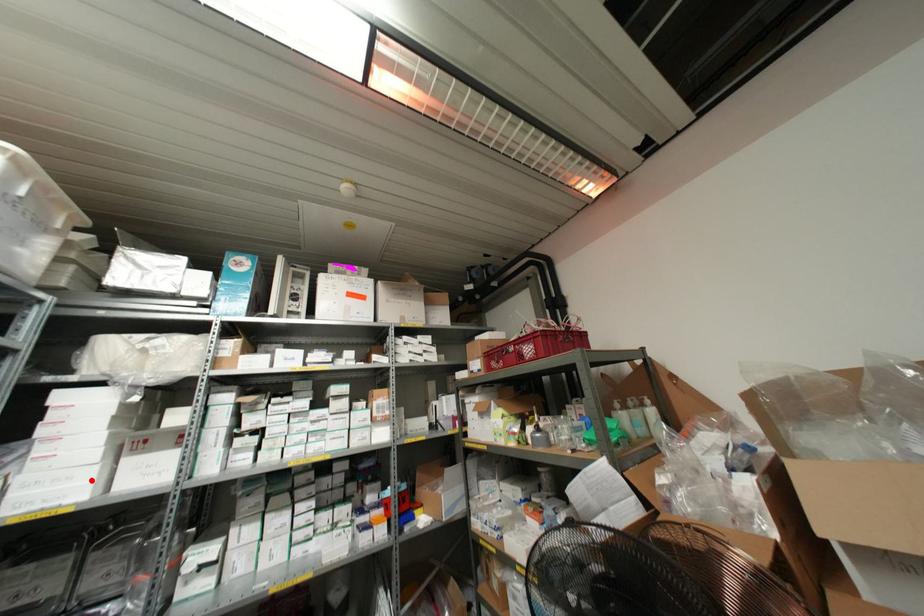
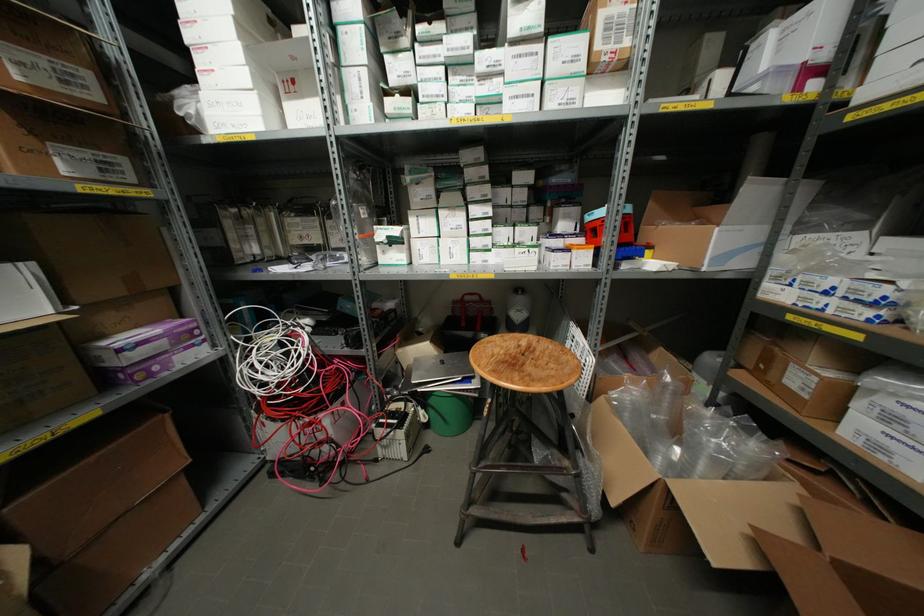
In the second image, find the point that corresponds to the highlighted location in the first image.

(257, 111)